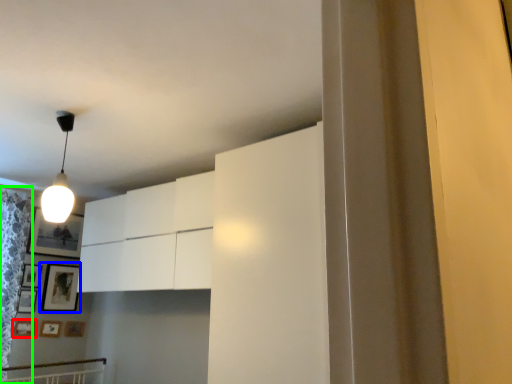
Question: Estimate the real-world distances between objects in this image. Which object is farther from picture frame (highlighted by a red box), picture frame (highlighted by a blue box) or curtain (highlighted by a green box)?

Choices:
 (A) picture frame
 (B) curtain

Answer: (B)